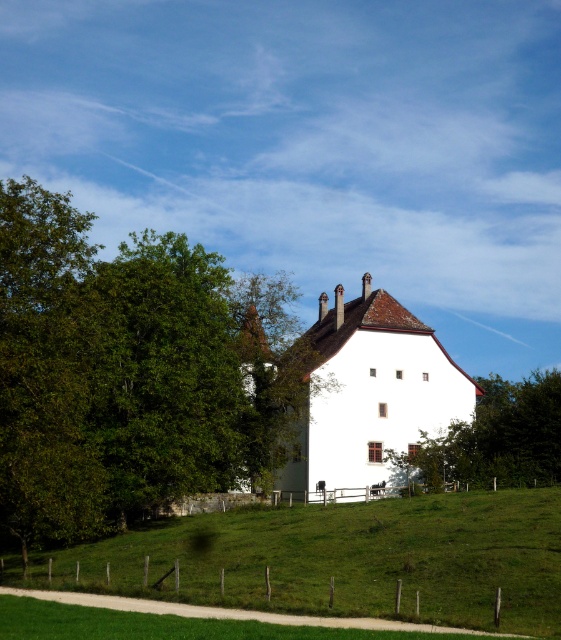
Question: Which object is closer to the camera taking this photo?

Choices:
 (A) green grassy hillside at lower center
 (B) green leafy tree at upper left
 (C) green grassy at lower center
 (D) green leafy tree at center

Answer: (C)

Question: Which point is closer to the camera?

Choices:
 (A) green grassy at lower center
 (B) green grassy hillside at lower center

Answer: (A)

Question: Which point is farther to the camera?

Choices:
 (A) (256, 625)
 (B) (442, 616)
 (C) (485, 401)

Answer: (C)

Question: Does green grassy at lower center appear on the left side of green leafy tree at center?

Choices:
 (A) yes
 (B) no

Answer: (A)

Question: Does green grassy hillside at lower center appear over green grassy at lower center?

Choices:
 (A) yes
 (B) no

Answer: (B)

Question: Considering the relative positions of green grassy hillside at lower center and green leafy tree at center in the image provided, where is green grassy hillside at lower center located with respect to green leafy tree at center?

Choices:
 (A) below
 (B) above

Answer: (A)